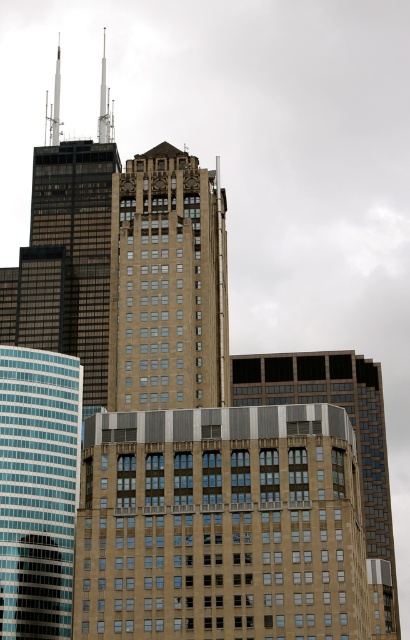
You are standing on the observation deck of the beige stone tower at center. Looking down, you notice the matte glass skyscraper at left. Which building appears taller from this vantage point?

Answer: The beige stone tower at center appears taller because it is positioned above the matte glass skyscraper at left in the image.

You are standing in front of the cluster of modern skyscrapers. You see the matte glass skyscraper at left and the brown glass building at center. Which one is positioned to the left of the other?

The matte glass skyscraper at left is positioned to the left of the brown glass building at center.